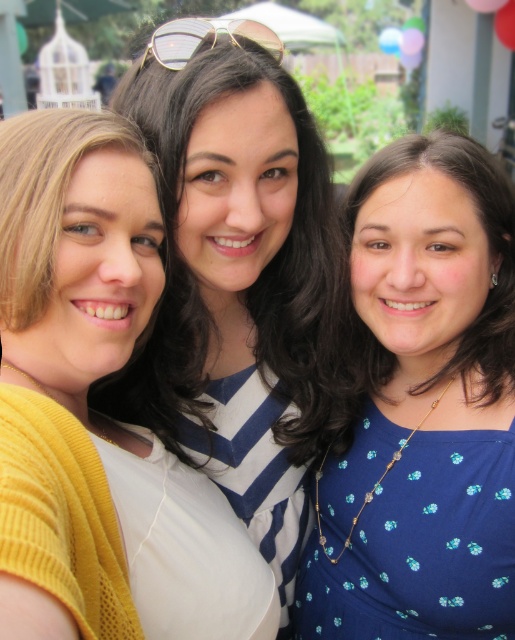
Question: Which of the following is the closest to the observer?

Choices:
 (A) (259, 26)
 (B) (461, 291)

Answer: (A)

Question: Where is white matte shirt at center located in relation to gold metallic sunglasses at center in the image?

Choices:
 (A) right
 (B) left

Answer: (A)

Question: Is white matte shirt at center below gold metallic sunglasses at center?

Choices:
 (A) no
 (B) yes

Answer: (B)

Question: Which of the following is the farthest from the observer?

Choices:
 (A) matte white shirt at center
 (B) blue dotted dress at center
 (C) gold metallic sunglasses at center
 (D) white matte shirt at center

Answer: (B)

Question: Which point is farther to the camera?

Choices:
 (A) gold metallic sunglasses at center
 (B) matte white shirt at center
 (C) blue dotted dress at center

Answer: (C)

Question: Is blue dotted dress at center bigger than white matte shirt at center?

Choices:
 (A) yes
 (B) no

Answer: (B)